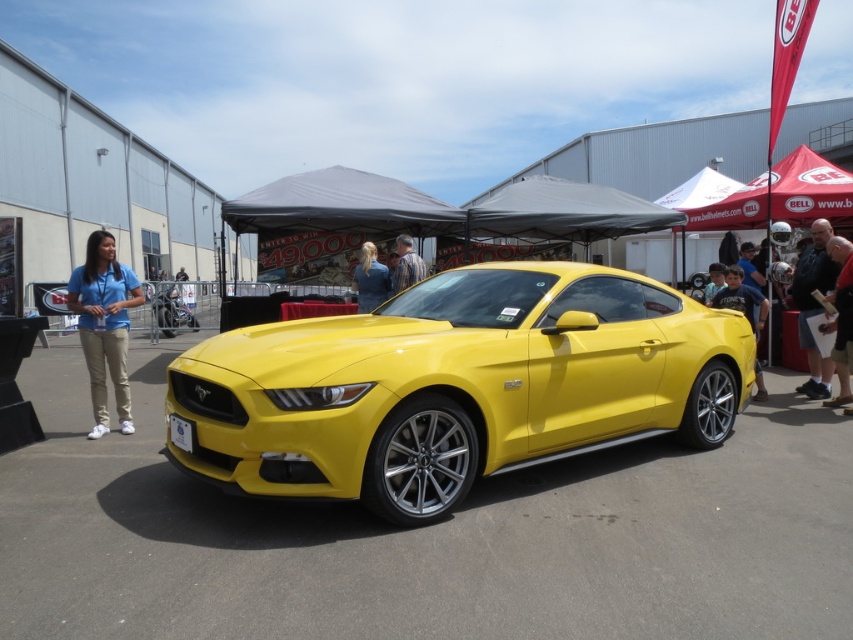
Is yellow glossy car at center bigger than striped shirt at center?

Indeed, yellow glossy car at center has a larger size compared to striped shirt at center.

Between yellow glossy car at center and striped shirt at center, which one has less height?

With less height is striped shirt at center.

The width and height of the screenshot is (853, 640). What are the coordinates of `yellow glossy car at center` in the screenshot? It's located at (456, 385).

Can you confirm if yellow glossy car at center is shorter than blue denim jacket at center?

No.

Does yellow glossy car at center have a smaller size compared to blue denim jacket at center?

Actually, yellow glossy car at center might be larger than blue denim jacket at center.

At what (x,y) coordinates should I click in order to perform the action: click on yellow glossy car at center. Please return your answer as a coordinate pair (x, y). Image resolution: width=853 pixels, height=640 pixels. Looking at the image, I should click on (456, 385).

Which is behind, point (838, 326) or point (355, 280)?

Positioned behind is point (355, 280).

Does point (848, 321) come in front of point (368, 248)?

Yes, it is.

This screenshot has width=853, height=640. What are the coordinates of `reddish-brown leather jacket at right` in the screenshot? It's located at (840, 317).